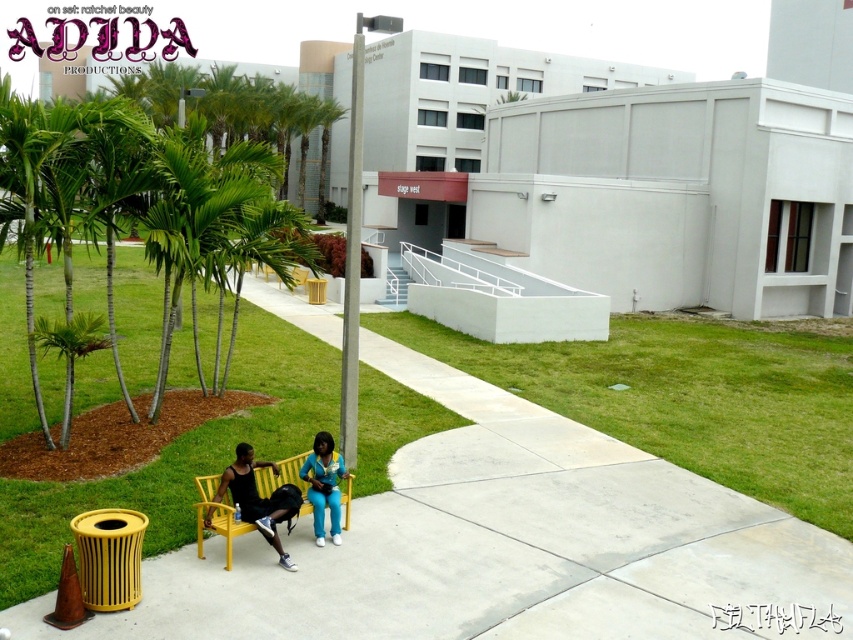
Can you confirm if yellow concrete bench at lower center is taller than blue fabric jacket at center?

No.

Which is behind, point (241, 595) or point (335, 506)?

The point (335, 506) is more distant.

Is point (634, 634) closer to camera compared to point (318, 444)?

Yes, it is.

Where is `yellow concrete bench at lower center`? Image resolution: width=853 pixels, height=640 pixels. yellow concrete bench at lower center is located at coordinates (508, 550).

Between point (480, 596) and point (218, 509), which one is positioned behind?

The point (218, 509) is behind.

In the scene shown: Can you confirm if yellow concrete bench at lower center is positioned below yellow painted wood bench at center?

Correct, yellow concrete bench at lower center is located below yellow painted wood bench at center.

Which is behind, point (454, 436) or point (288, 476)?

The point (454, 436) is more distant.

The width and height of the screenshot is (853, 640). I want to click on yellow concrete bench at lower center, so click(x=508, y=550).

Between yellow concrete bench at lower center and green grass at lower left, which one appears on the right side from the viewer's perspective?

yellow concrete bench at lower center is more to the right.

Does yellow concrete bench at lower center appear on the left side of green grass at lower left?

In fact, yellow concrete bench at lower center is to the right of green grass at lower left.

In order to click on yellow concrete bench at lower center in this screenshot , I will do `click(508, 550)`.